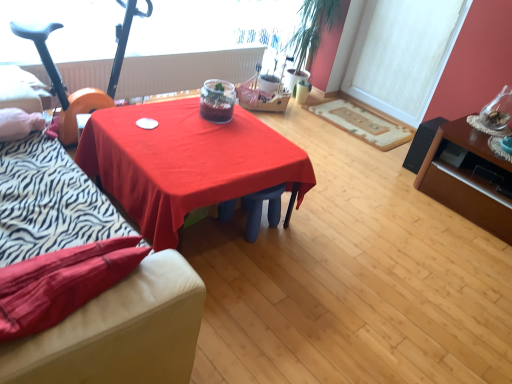
What is the approximate width of white textured window screen at upper right?

The width of white textured window screen at upper right is 7.13 centimeters.

What do you see at coordinates (313, 28) in the screenshot? The image size is (512, 384). I see `green leafy plant at upper right` at bounding box center [313, 28].

What do you see at coordinates (168, 280) in the screenshot?
I see `velvet-like red couch at lower left` at bounding box center [168, 280].

The height and width of the screenshot is (384, 512). What do you see at coordinates (185, 162) in the screenshot? I see `matte red tablecloth at center, which is counted as the 2th table, starting from the right` at bounding box center [185, 162].

This screenshot has width=512, height=384. In order to click on beige carpet at lower center in this screenshot , I will do `click(362, 124)`.

Locate an element on the screen. radiator above the translucent glass jar at center (from the image's perspective) is located at coordinates (184, 71).

Which point is more forward, (x=154, y=58) or (x=216, y=83)?

The point (x=216, y=83) is more forward.

Is white textured radiator at upper center not inside translucent glass jar at center?

That's correct, white textured radiator at upper center is outside of translucent glass jar at center.

Are white textured radiator at upper center and translucent glass jar at center far apart?

They are positioned close to each other.

Is translucent glass jar at center taller or shorter than beige carpet at lower center?

In the image, translucent glass jar at center appears to be taller than beige carpet at lower center.

From a real-world perspective, who is located higher, translucent glass jar at center or beige carpet at lower center?

In real-world perspective, translucent glass jar at center is above.

Is translucent glass jar at center far from beige carpet at lower center?

Yes, translucent glass jar at center and beige carpet at lower center are quite far apart.

Between velvet-like red couch at lower left and matte red tablecloth at center, which is counted as the 2th table, starting from the right, which one appears on the right side from the viewer's perspective?

matte red tablecloth at center, which is counted as the 2th table, starting from the right.

Is point (165, 292) closer or farther from the camera than point (266, 151)?

Point (165, 292) appears to be closer to the viewer than point (266, 151).

Between velvet-like red couch at lower left and matte red tablecloth at center, which is counted as the 2th table, starting from the right, which one has larger size?

matte red tablecloth at center, which is counted as the 2th table, starting from the right.

From a real-world perspective, does velvet-like red couch at lower left sit lower than matte red tablecloth at center, which ranks as the 1th table in left-to-right order?

No.

Considering the relative sizes of velvet-like red couch at lower left and white textured window screen at upper right in the image provided, is velvet-like red couch at lower left smaller than white textured window screen at upper right?

No, velvet-like red couch at lower left is not smaller than white textured window screen at upper right.

From a real-world perspective, is velvet-like red couch at lower left located higher than white textured window screen at upper right?

No.

Is velvet-like red couch at lower left facing away from white textured window screen at upper right?

No, velvet-like red couch at lower left's orientation is not away from white textured window screen at upper right.

From the image's perspective, which object appears higher, velvet-like red couch at lower left or white textured window screen at upper right?

white textured window screen at upper right, from the image's perspective.

Can you confirm if beige carpet at lower center is bigger than white textured window screen at upper right?

Incorrect, beige carpet at lower center is not larger than white textured window screen at upper right.

Is beige carpet at lower center in contact with white textured window screen at upper right?

No.

In terms of width, does beige carpet at lower center look wider or thinner when compared to white textured window screen at upper right?

beige carpet at lower center is wider than white textured window screen at upper right.

From the image's perspective, which is above, beige carpet at lower center or white textured window screen at upper right?

white textured window screen at upper right.

From the image's perspective, which one is positioned lower, white textured radiator at upper center or matte black speaker at right, acting as the 1th table starting from the right?

From the image's view, matte black speaker at right, acting as the 1th table starting from the right, is below.

Is white textured radiator at upper center positioned with its back to matte black speaker at right, acting as the 1th table starting from the right?

No, white textured radiator at upper center's orientation is not away from matte black speaker at right, acting as the 1th table starting from the right.

Considering the positions of point (96, 75) and point (423, 163), is point (96, 75) closer or farther from the camera than point (423, 163)?

Point (96, 75).

Considering the relative positions of white textured radiator at upper center and matte black speaker at right, the second table positioned from the left, in the image provided, is white textured radiator at upper center in front of matte black speaker at right, the second table positioned from the left,?

No, it is not.

Who is bigger, matte red tablecloth at center, which ranks as the 1th table in left-to-right order, or white textured radiator at upper center?

Bigger between the two is matte red tablecloth at center, which ranks as the 1th table in left-to-right order.

Would you say white textured radiator at upper center is part of matte red tablecloth at center, which is counted as the 2th table, starting from the right,'s contents?

No, white textured radiator at upper center is located outside of matte red tablecloth at center, which is counted as the 2th table, starting from the right.

Is point (153, 209) positioned in front of point (135, 59)?

That is True.

At what (x,y) coordinates should I click in order to perform the action: click on glass jar positioned vertically above the white textured radiator at upper center (from a real-world perspective). Please return your answer as a coordinate pair (x, y). The image size is (512, 384). Looking at the image, I should click on (217, 101).

Find the location of a particular element. The image size is (512, 384). mat that is under the translucent glass jar at center (from a real-world perspective) is located at coordinates (362, 124).

Looking at the image, which one is located further to beige carpet at lower center, velvet-like red couch at lower left or matte black speaker at right, acting as the 1th table starting from the right?

velvet-like red couch at lower left.

From the image, which object appears to be nearer to matte black speaker at right, the second table positioned from the left, white textured radiator at upper center or translucent glass jar at center?

translucent glass jar at center.

Which object lies nearer to the anchor point beige carpet at lower center, orange rubber baby carriage at left or matte red tablecloth at center, which ranks as the 1th table in left-to-right order?

Among the two, matte red tablecloth at center, which ranks as the 1th table in left-to-right order, is located nearer to beige carpet at lower center.

Based on their spatial positions, is velvet-like red couch at lower left or translucent glass jar at center further from white textured window screen at upper right?

Based on the image, velvet-like red couch at lower left appears to be further to white textured window screen at upper right.

Based on their spatial positions, is white textured radiator at upper center or matte black speaker at right, the second table positioned from the left, closer to velvet-like red couch at lower left?

The object closer to velvet-like red couch at lower left is white textured radiator at upper center.

Estimate the real-world distances between objects in this image. Which object is further from green leafy plant at upper right, matte black speaker at right, the second table positioned from the left, or translucent glass jar at center?

matte black speaker at right, the second table positioned from the left, is positioned further to the anchor green leafy plant at upper right.

From the image, which object appears to be farther from green leafy plant at upper right, velvet-like red couch at lower left or translucent glass jar at center?

velvet-like red couch at lower left is positioned further to the anchor green leafy plant at upper right.

Looking at the image, which one is located further to green leafy plant at upper right, translucent glass jar at center or matte red tablecloth at center, which is counted as the 2th table, starting from the right?

matte red tablecloth at center, which is counted as the 2th table, starting from the right.

Identify the location of baby carriage between velvet-like red couch at lower left and translucent glass jar at center along the z-axis. The height and width of the screenshot is (384, 512). [x=85, y=88].

The image size is (512, 384). I want to click on radiator located between orange rubber baby carriage at left and translucent glass jar at center in the left-right direction, so click(x=184, y=71).

You are a GUI agent. You are given a task and a screenshot of the screen. Output one action in this format:
    pyautogui.click(x=<x>, y=<y>)
    Task: Click on the plant between translucent glass jar at center and matte black speaker at right, the second table positioned from the left
    This screenshot has width=512, height=384.
    Given the screenshot: What is the action you would take?
    pyautogui.click(x=313, y=28)

Where is `plant between matte red tablecloth at center, which is counted as the 2th table, starting from the right, and beige carpet at lower center in the front-back direction`? The height and width of the screenshot is (384, 512). plant between matte red tablecloth at center, which is counted as the 2th table, starting from the right, and beige carpet at lower center in the front-back direction is located at coordinates (313, 28).